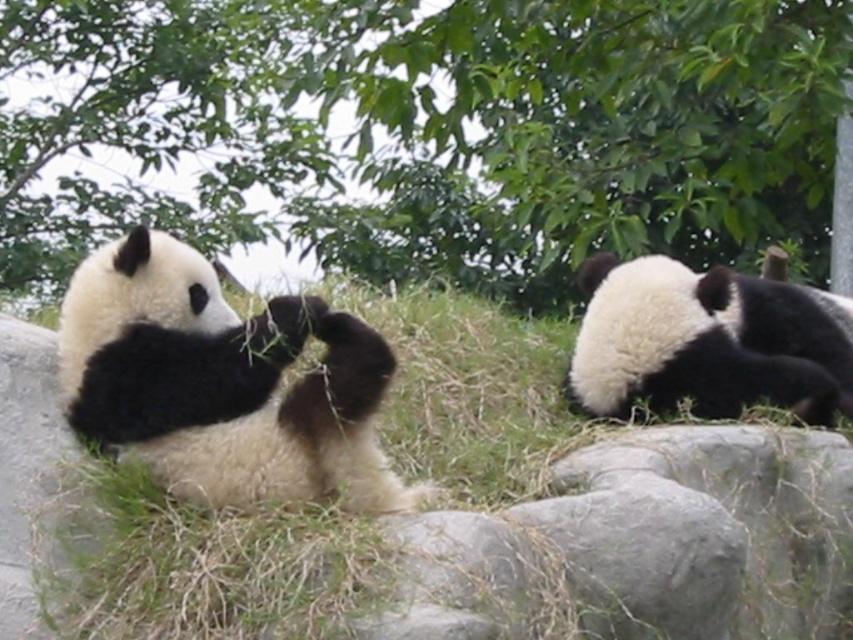
Question: Is green leafy tree at upper center above black fur panda at upper right?

Choices:
 (A) yes
 (B) no

Answer: (A)

Question: Can you confirm if green grass at center is thinner than black fuzzy panda at left?

Choices:
 (A) yes
 (B) no

Answer: (B)

Question: Is green leafy tree at upper center thinner than black fur panda at upper right?

Choices:
 (A) yes
 (B) no

Answer: (B)

Question: Considering the real-world distances, which object is closest to the green grass at center?

Choices:
 (A) green leafy tree at upper center
 (B) black fuzzy panda at left
 (C) black fur panda at upper right

Answer: (B)

Question: Which point is closer to the camera?

Choices:
 (A) (677, 352)
 (B) (351, 483)
 (C) (657, 26)

Answer: (B)

Question: Which is nearer to the black fur panda at upper right?

Choices:
 (A) green grass at center
 (B) green leafy tree at upper center

Answer: (A)